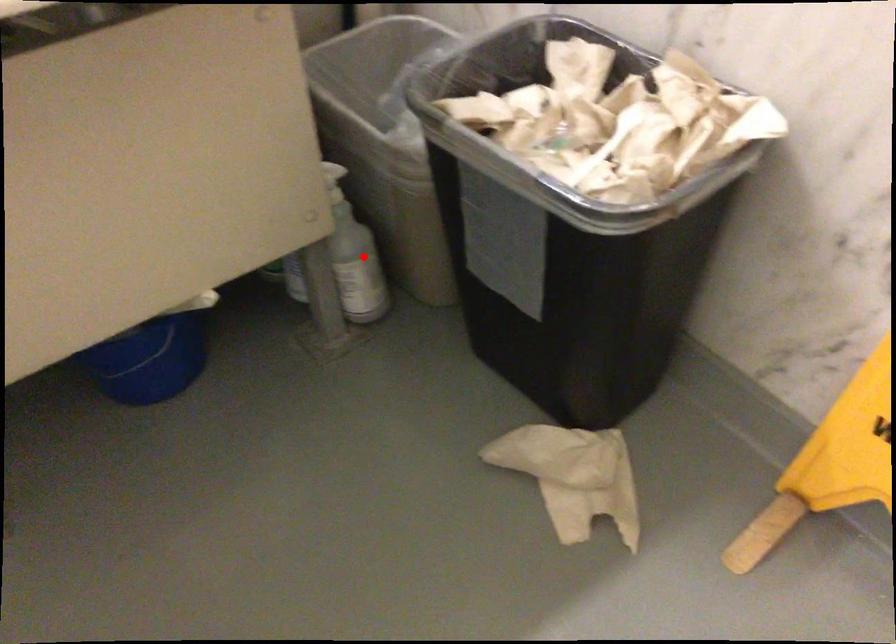
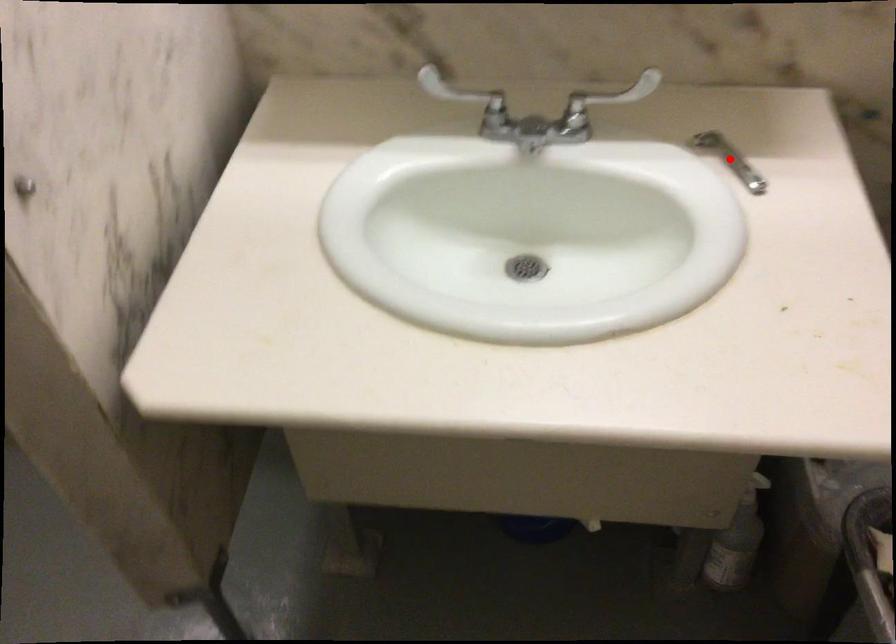
I am providing you with two images of the same scene from different viewpoints. A red point is marked on the first image and another point is marked on the second image. Are the points marked in image1 and image2 representing the same 3D position?

No